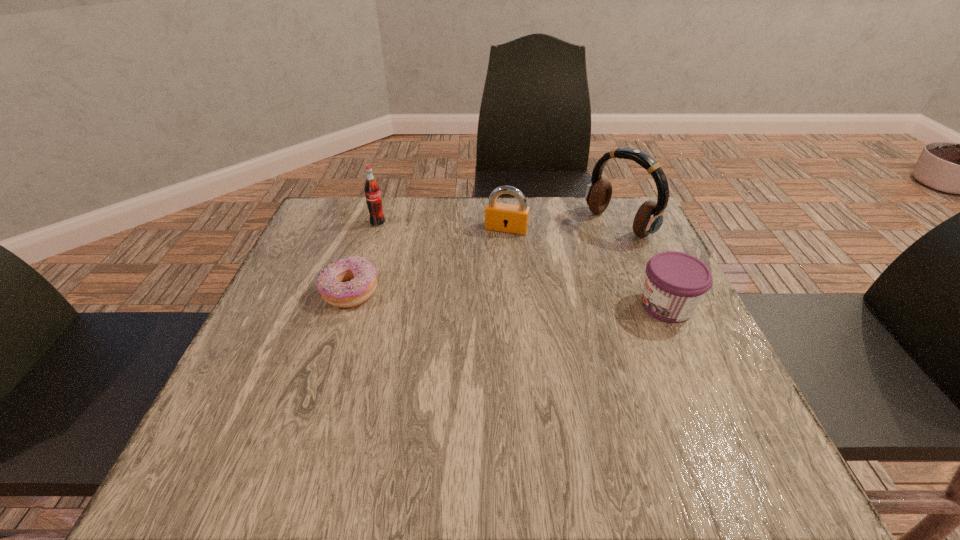
The height and width of the screenshot is (540, 960). What are the coordinates of `vacant space at the right edge of the desktop` in the screenshot? It's located at (624, 289).

In the image, there is a desktop. Identify the location of free region at the near left corner. (249, 397).

This screenshot has width=960, height=540. In order to click on vacant area at the far right corner of the desktop in this screenshot , I will do `click(639, 241)`.

Find the location of `free space between the jam and the shortest object`. free space between the jam and the shortest object is located at coordinates (509, 299).

The image size is (960, 540). In order to click on vacant region between the shortest object and the soda bottle in this screenshot , I will do `click(364, 258)`.

Find the location of a particular element. The image size is (960, 540). vacant region between the second shortest object and the shortest object is located at coordinates (509, 299).

Locate an element on the screen. This screenshot has width=960, height=540. free space between the headset and the third shortest object is located at coordinates (563, 227).

I want to click on free spot between the shortest object and the fourth tallest object, so click(x=509, y=299).

Identify the location of vacant area that lies between the third tallest object and the jam. (587, 267).

Identify the location of free space that is in between the padlock and the soda bottle. (443, 226).